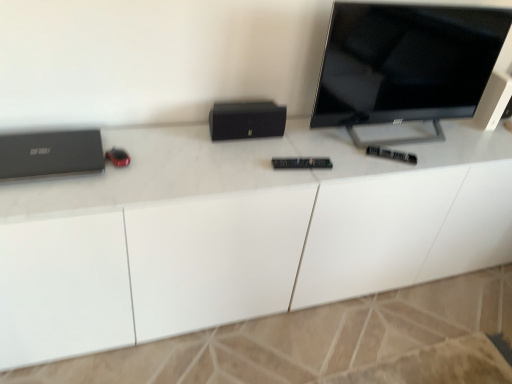
What are the coordinates of `free spot below black matte speaker at center (from a real-world perspective)` in the screenshot? It's located at (248, 141).